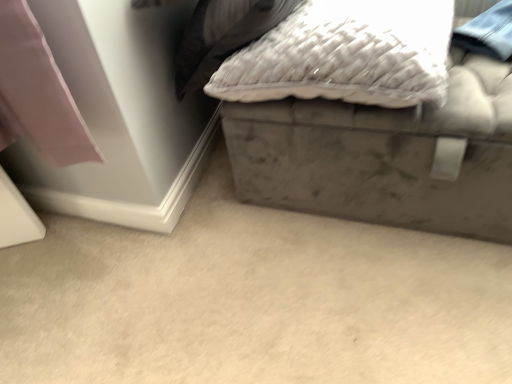
Question: From a real-world perspective, is white textured pillow at upper center beneath gray matte storage box at lower right?

Choices:
 (A) no
 (B) yes

Answer: (A)

Question: From the image's perspective, would you say white textured pillow at upper center is shown under gray matte storage box at lower right?

Choices:
 (A) no
 (B) yes

Answer: (A)

Question: Can you confirm if white textured pillow at upper center is thinner than gray matte storage box at lower right?

Choices:
 (A) no
 (B) yes

Answer: (B)

Question: Is white textured pillow at upper center outside of gray matte storage box at lower right?

Choices:
 (A) no
 (B) yes

Answer: (B)

Question: Is gray matte storage box at lower right at the back of white textured pillow at upper center?

Choices:
 (A) yes
 (B) no

Answer: (B)

Question: From a real-world perspective, is velvet gray ottoman at upper right positioned above or below white textured pillow at upper center?

Choices:
 (A) above
 (B) below

Answer: (B)

Question: From their relative heights in the image, would you say velvet gray ottoman at upper right is taller or shorter than white textured pillow at upper center?

Choices:
 (A) tall
 (B) short

Answer: (A)

Question: Do you think velvet gray ottoman at upper right is within white textured pillow at upper center, or outside of it?

Choices:
 (A) outside
 (B) inside

Answer: (A)

Question: Considering the positions of point (310, 167) and point (372, 14), is point (310, 167) closer or farther from the camera than point (372, 14)?

Choices:
 (A) farther
 (B) closer

Answer: (A)

Question: From the image's perspective, relative to white textured pillow at upper center, is gray matte storage box at lower right above or below?

Choices:
 (A) above
 (B) below

Answer: (B)

Question: Is point (260, 311) positioned closer to the camera than point (440, 54)?

Choices:
 (A) closer
 (B) farther

Answer: (B)

Question: Relative to white textured pillow at upper center, is gray matte storage box at lower right in front or behind?

Choices:
 (A) behind
 (B) front

Answer: (B)

Question: Visually, is gray matte storage box at lower right positioned to the left or to the right of white textured pillow at upper center?

Choices:
 (A) right
 (B) left

Answer: (B)

Question: From a real-world perspective, relative to velvet gray ottoman at upper right, is gray matte storage box at lower right vertically above or below?

Choices:
 (A) below
 (B) above

Answer: (A)

Question: Is gray matte storage box at lower right wider or thinner than velvet gray ottoman at upper right?

Choices:
 (A) wide
 (B) thin

Answer: (A)